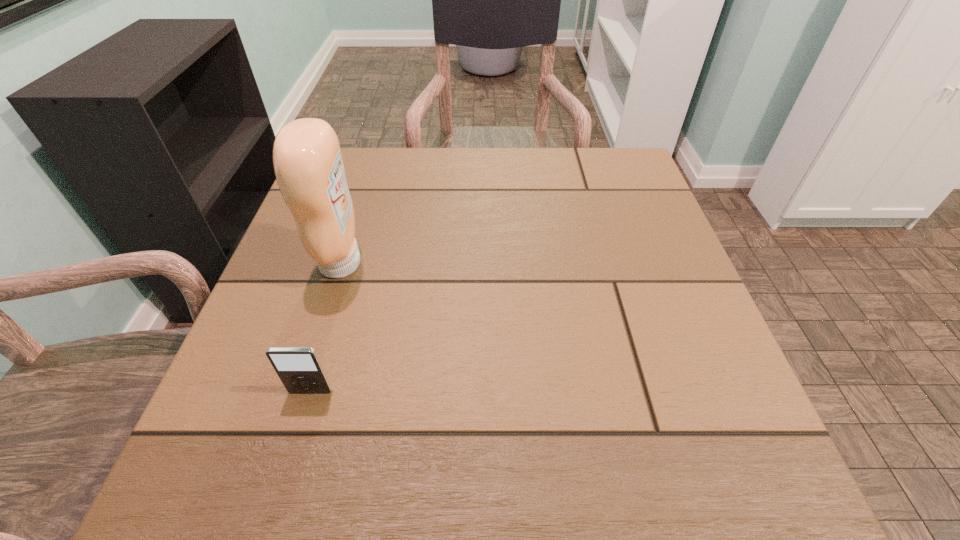
This screenshot has width=960, height=540. I want to click on free location at the right edge, so click(633, 223).

Where is `vacant space at the near left corner`? vacant space at the near left corner is located at coordinates (268, 498).

Find the location of a particular element. The width and height of the screenshot is (960, 540). blank space at the far right corner of the desktop is located at coordinates pos(579,173).

What are the coordinates of `vacant space at the near right corner of the desktop` in the screenshot? It's located at 673,441.